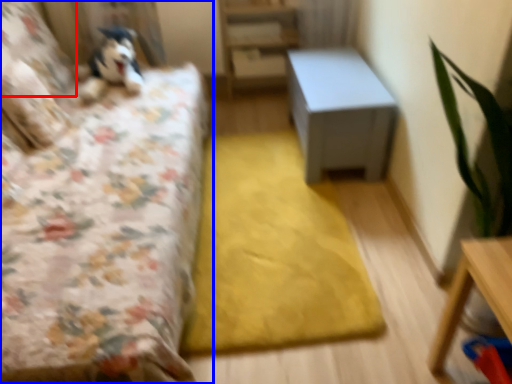
Question: Which object is closer to the camera taking this photo, pillow (highlighted by a red box) or bed (highlighted by a blue box)?

Choices:
 (A) pillow
 (B) bed

Answer: (B)